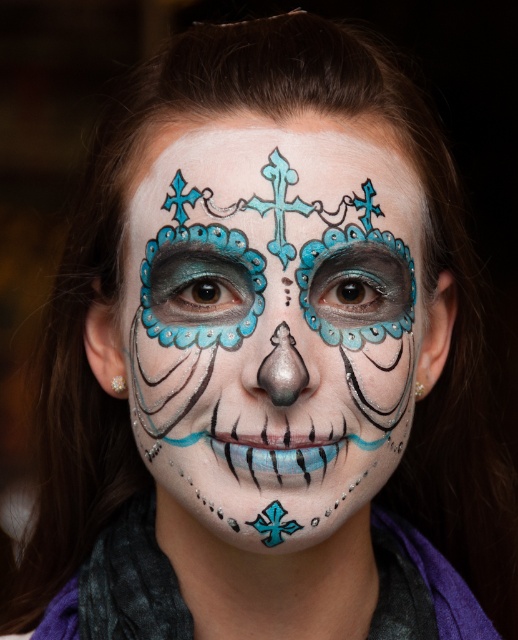
Question: Is matte blue face paint at center to the right of blue glossy cross at lower center from the viewer's perspective?

Choices:
 (A) no
 (B) yes

Answer: (B)

Question: Can you confirm if matte blue face paint at center is positioned above blue glossy cross at lower center?

Choices:
 (A) no
 (B) yes

Answer: (B)

Question: From the image, what is the correct spatial relationship of matte blue face paint at center in relation to blue glossy cross at lower center?

Choices:
 (A) above
 (B) below

Answer: (A)

Question: Which point is closer to the camera taking this photo?

Choices:
 (A) (x=251, y=250)
 (B) (x=257, y=529)

Answer: (A)